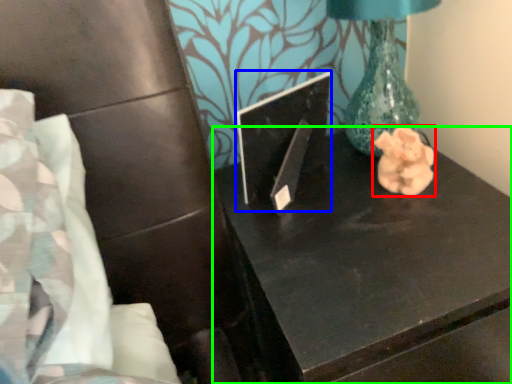
Question: Estimate the real-world distances between objects in this image. Which object is closer to animal (highlighted by a red box), laptop (highlighted by a blue box) or table (highlighted by a green box)?

Choices:
 (A) laptop
 (B) table

Answer: (B)